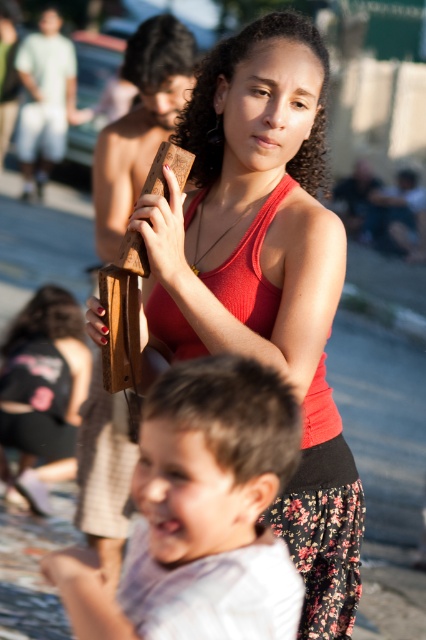
Looking at this image, you are organizing a childrens craft activity and have two items in front of you the matte wood block at center and the matte brown wooden object at center. You need to choose which one is wider to use as a base for a project. Which one should you pick?

The matte wood block at center is wider than the matte brown wooden object at center, so you should choose the matte wood block at center as the base for your project.

You are standing in the park and see two points in the scene. Which point is closer to you, point [331,308] or point [55,401]?

Point [331,308] is closer to the viewer than point [55,401].